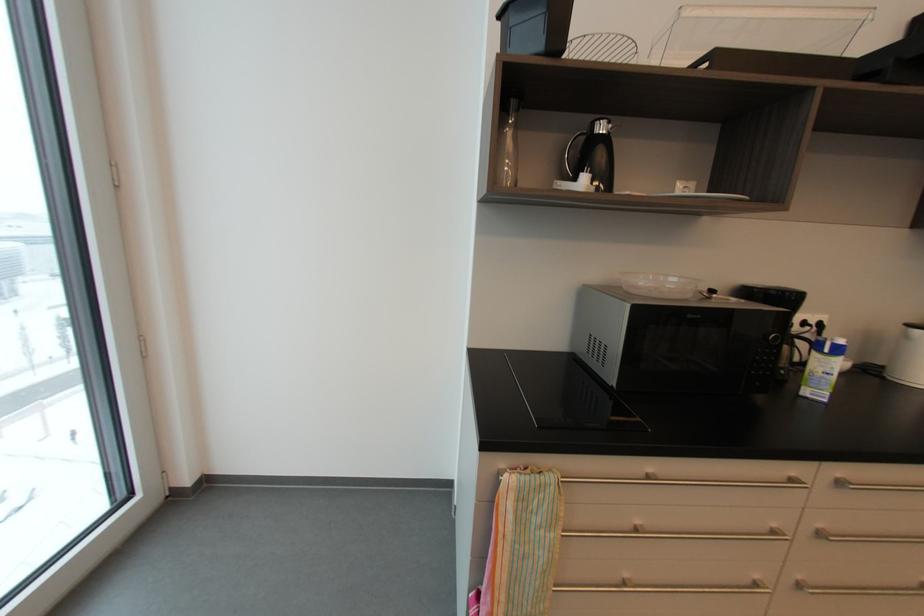
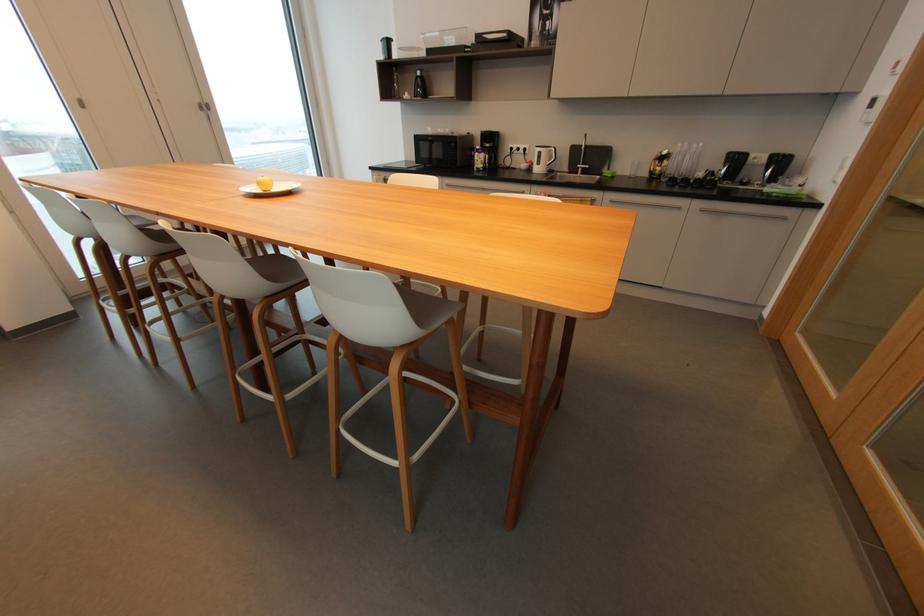
Where in the second image is the point corresponding to point 603,128 from the first image?

(421, 74)